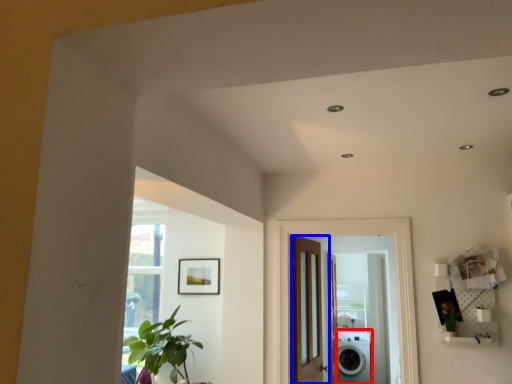
Question: Which object appears farthest to the camera in this image, washing machine (highlighted by a red box) or door (highlighted by a blue box)?

Choices:
 (A) washing machine
 (B) door

Answer: (A)